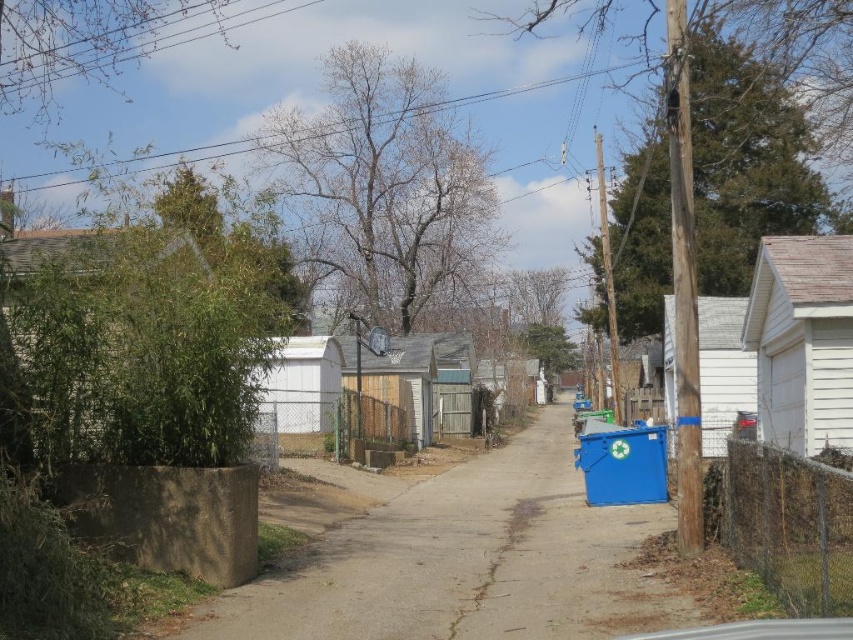
Is blue plastic bin at right to the right of wire mesh fence at lower right from the viewer's perspective?

No, blue plastic bin at right is not to the right of wire mesh fence at lower right.

Does blue plastic bin at right have a lesser height compared to wire mesh fence at lower right?

Incorrect, blue plastic bin at right's height does not fall short of wire mesh fence at lower right's.

You are a GUI agent. You are given a task and a screenshot of the screen. Output one action in this format:
    pyautogui.click(x=<x>, y=<y>)
    Task: Click on the blue plastic bin at right
    This screenshot has width=853, height=640.
    Given the screenshot: What is the action you would take?
    pyautogui.click(x=465, y=561)

What do you see at coordinates (790, 525) in the screenshot? The height and width of the screenshot is (640, 853). I see `wire mesh fence at lower right` at bounding box center [790, 525].

Does wire mesh fence at lower right come in front of green chain-link fence at center?

Yes, it is in front of green chain-link fence at center.

Identify the location of wire mesh fence at lower right. (790, 525).

From the picture: Who is more distant from viewer, (599, 577) or (312, 397)?

The point (312, 397) is behind.

Measure the distance between blue plastic bin at right and green chain-link fence at center.

The distance of blue plastic bin at right from green chain-link fence at center is 3.26 meters.

Describe the element at coordinates (465, 561) in the screenshot. I see `blue plastic bin at right` at that location.

Identify the location of blue plastic bin at right. (465, 561).